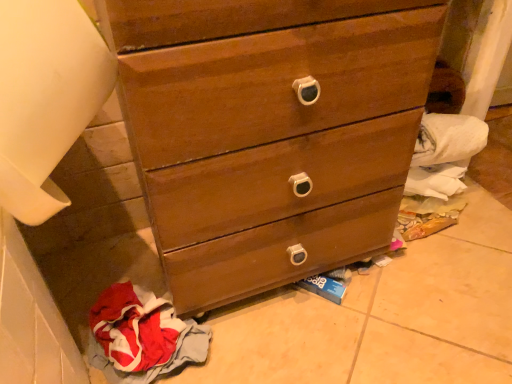
Question: Is wooden chest of drawers at center thinner than red cotton cloth at lower left?

Choices:
 (A) no
 (B) yes

Answer: (A)

Question: Is wooden chest of drawers at center positioned behind red cotton cloth at lower left?

Choices:
 (A) yes
 (B) no

Answer: (B)

Question: From the image's perspective, is wooden chest of drawers at center under red cotton cloth at lower left?

Choices:
 (A) no
 (B) yes

Answer: (A)

Question: From a real-world perspective, does wooden chest of drawers at center sit lower than red cotton cloth at lower left?

Choices:
 (A) no
 (B) yes

Answer: (A)

Question: Can you confirm if wooden chest of drawers at center is wider than red cotton cloth at lower left?

Choices:
 (A) no
 (B) yes

Answer: (B)

Question: Is red cotton cloth at lower left at the back of wooden chest of drawers at center?

Choices:
 (A) yes
 (B) no

Answer: (B)

Question: Considering the relative sizes of red cotton cloth at lower left and wooden chest of drawers at center in the image provided, is red cotton cloth at lower left wider than wooden chest of drawers at center?

Choices:
 (A) yes
 (B) no

Answer: (B)

Question: Is red cotton cloth at lower left closer to the viewer compared to wooden chest of drawers at center?

Choices:
 (A) yes
 (B) no

Answer: (B)

Question: From the image's perspective, is red cotton cloth at lower left on wooden chest of drawers at center?

Choices:
 (A) yes
 (B) no

Answer: (B)

Question: From a real-world perspective, is red cotton cloth at lower left beneath wooden chest of drawers at center?

Choices:
 (A) no
 (B) yes

Answer: (B)

Question: Would you consider red cotton cloth at lower left to be distant from wooden chest of drawers at center?

Choices:
 (A) no
 (B) yes

Answer: (A)

Question: Is red cotton cloth at lower left oriented towards wooden chest of drawers at center?

Choices:
 (A) yes
 (B) no

Answer: (B)

Question: Based on their positions, is wooden chest of drawers at center located to the left or right of red cotton cloth at lower left?

Choices:
 (A) right
 (B) left

Answer: (A)